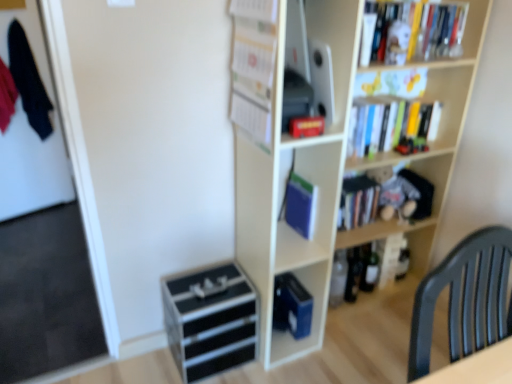
At what (x,y) coordinates should I click in order to perform the action: click on hardcover books at upper right. Please return your answer as a coordinate pair (x, y). The height and width of the screenshot is (384, 512). Looking at the image, I should click on (448, 101).

Where is `blue matte book at center, arranged as the 2th paperback book when viewed from the top`? blue matte book at center, arranged as the 2th paperback book when viewed from the top is located at coordinates (292, 306).

The image size is (512, 384). Describe the element at coordinates (370, 269) in the screenshot. I see `green glass bottle at lower right, which appears as the 2th beer bottle when viewed from the left` at that location.

What is the approximate width of matte black speaker at upper center?

The width of matte black speaker at upper center is 24.66 centimeters.

The height and width of the screenshot is (384, 512). What are the coordinates of `blue matte book at center, which is the first paperback book in top-to-bottom order` in the screenshot? It's located at point(301,205).

The height and width of the screenshot is (384, 512). Describe the element at coordinates (301, 205) in the screenshot. I see `blue matte book at center, which is the first paperback book in top-to-bottom order` at that location.

Describe the element at coordinates (422, 32) in the screenshot. Image resolution: width=512 pixels, height=384 pixels. I see `hardcover book at upper right, which is the 3th book in left-to-right order` at that location.

The width and height of the screenshot is (512, 384). Identify the location of dark blue fabric at left. (29, 81).

From a real-world perspective, is black glass beer bottle at lower center, positioned as the first beer bottle in left-to-right order, under dark blue fabric at left?

Yes, from a real-world perspective, black glass beer bottle at lower center, positioned as the first beer bottle in left-to-right order, is under dark blue fabric at left.

Does point (350, 277) come farther from viewer compared to point (14, 71)?

No, (350, 277) is in front of (14, 71).

Is black glass beer bottle at lower center, positioned as the first beer bottle in left-to-right order, in front of or behind dark blue fabric at left in the image?

black glass beer bottle at lower center, positioned as the first beer bottle in left-to-right order, is in front of dark blue fabric at left.

Where is `clothe above the black glass beer bottle at lower center, marked as the 2th beer bottle in a right-to-left arrangement (from a real-world perspective)`? clothe above the black glass beer bottle at lower center, marked as the 2th beer bottle in a right-to-left arrangement (from a real-world perspective) is located at coordinates (29, 81).

From their relative heights in the image, would you say plush gray bear at upper right is taller or shorter than blue matte book at center, which is the first paperback book in top-to-bottom order?

Clearly, plush gray bear at upper right is taller compared to blue matte book at center, which is the first paperback book in top-to-bottom order.

Is blue matte book at center, the first paperback book viewed from the front, at the back of plush gray bear at upper right?

No, plush gray bear at upper right is not facing the opposite direction of blue matte book at center, the first paperback book viewed from the front.

Consider the image. Is plush gray bear at upper right touching blue matte book at center, the first paperback book viewed from the front?

No, plush gray bear at upper right is not with blue matte book at center, the first paperback book viewed from the front.

Is plush gray bear at upper right further to camera compared to blue matte book at center, which is the first paperback book in top-to-bottom order?

That is True.

Is blue matte book at center, arranged as the 2th paperback book when viewed from the top, looking in the opposite direction of black plastic drawer at lower center?

No, blue matte book at center, arranged as the 2th paperback book when viewed from the top, is not facing away from black plastic drawer at lower center.

From the image's perspective, is blue matte book at center, acting as the second paperback book starting from the front, above or below black plastic drawer at lower center?

blue matte book at center, acting as the second paperback book starting from the front, is above black plastic drawer at lower center.

Is blue matte book at center, arranged as the 2th paperback book when viewed from the top, smaller than black plastic drawer at lower center?

Indeed, blue matte book at center, arranged as the 2th paperback book when viewed from the top, has a smaller size compared to black plastic drawer at lower center.

Which is in front, blue matte book at center, the 1th paperback book viewed from the back, or black plastic drawer at lower center?

Positioned in front is black plastic drawer at lower center.

Is white paper calendar at upper center, the 1th book positioned from the left, to the left of blue matte book at center, which ranks as the second paperback book in back-to-front order, from the viewer's perspective?

Correct, you'll find white paper calendar at upper center, the 1th book positioned from the left, to the left of blue matte book at center, which ranks as the second paperback book in back-to-front order.

From the image's perspective, count 1st paperback books downward from the white paper calendar at upper center, the 2th book positioned from the top, and point to it. Please provide its 2D coordinates.

[(301, 205)]

Is white paper calendar at upper center, which appears as the 3th book when viewed from the back, with blue matte book at center, the first paperback book viewed from the front?

No, white paper calendar at upper center, which appears as the 3th book when viewed from the back, is not making contact with blue matte book at center, the first paperback book viewed from the front.

Locate an element on the screen. The image size is (512, 384). shelf on the right of the dark blue fabric at left is located at coordinates (448, 101).

Is dark blue fabric at left further to the viewer compared to hardcover books at upper right?

Yes, the depth of dark blue fabric at left is greater than that of hardcover books at upper right.

Considering the relative sizes of dark blue fabric at left and hardcover books at upper right in the image provided, is dark blue fabric at left wider than hardcover books at upper right?

Incorrect, the width of dark blue fabric at left does not surpass that of hardcover books at upper right.

Find the location of a particular element. The image size is (512, 384). cabinet located in front of the hardcover book at upper right, which is the 3th book in left-to-right order is located at coordinates (312, 55).

From the image's perspective, which one is positioned higher, matte black speaker at upper center or hardcover book at upper right, arranged as the first book when viewed from the right?

hardcover book at upper right, arranged as the first book when viewed from the right.

Is hardcover book at upper right, which is counted as the second book, starting from the front, inside matte black speaker at upper center?

No.

From a real-world perspective, is matte black speaker at upper center under hardcover book at upper right, which is counted as the second book, starting from the front?

Yes, from a real-world perspective, matte black speaker at upper center is beneath hardcover book at upper right, which is counted as the second book, starting from the front.

Is matte black speaker at upper center spatially inside blue matte book at center, the first paperback book ordered from the bottom, or outside of it?

matte black speaker at upper center cannot be found inside blue matte book at center, the first paperback book ordered from the bottom.

Considering the relative sizes of matte black speaker at upper center and blue matte book at center, arranged as the 2th paperback book when viewed from the top, in the image provided, is matte black speaker at upper center smaller than blue matte book at center, arranged as the 2th paperback book when viewed from the top,?

No, matte black speaker at upper center is not smaller than blue matte book at center, arranged as the 2th paperback book when viewed from the top.

From the image's perspective, count 2nd paperback books downward from the matte black speaker at upper center and point to it. Please provide its 2D coordinates.

[(292, 306)]

Consider the image. From the image's perspective, would you say matte black speaker at upper center is positioned over blue matte book at center, the 1th paperback book viewed from the back?

Yes, from the image's perspective, matte black speaker at upper center is above blue matte book at center, the 1th paperback book viewed from the back.

Find the location of `clothe that is above the black glass beer bottle at lower center, marked as the 2th beer bottle in a right-to-left arrangement (from the image's perspective)`. clothe that is above the black glass beer bottle at lower center, marked as the 2th beer bottle in a right-to-left arrangement (from the image's perspective) is located at coordinates (29, 81).

Image resolution: width=512 pixels, height=384 pixels. I want to click on paperback book above the plush gray bear at upper right (from a real-world perspective), so click(x=301, y=205).

Estimate the real-world distances between objects in this image. Which object is closer to green glass bottle at lower right, marked as the first beer bottle in a right-to-left arrangement, blue matte book at center, which is the first paperback book in top-to-bottom order, or hardcover books at upper right?

blue matte book at center, which is the first paperback book in top-to-bottom order.

When comparing their distances from blue matte book at center, the first paperback book ordered from the bottom, does plush gray bear at upper right or black plastic drawer at lower center seem further?

Based on the image, plush gray bear at upper right appears to be further to blue matte book at center, the first paperback book ordered from the bottom.

From the picture: Considering their positions, is hardcover books at upper right positioned closer to white paper calendar at upper center, the 1th book positioned from the left, than wooden bookcase at upper right?

The object closer to white paper calendar at upper center, the 1th book positioned from the left, is wooden bookcase at upper right.

Which object lies nearer to the anchor point blue matte book at center, the second paperback book ordered from the bottom, plush gray bear at upper right or dark blue fabric at left?

Among the two, plush gray bear at upper right is located nearer to blue matte book at center, the second paperback book ordered from the bottom.

Looking at the image, which one is located further to blue matte book at center, acting as the second paperback book starting from the front, matte black speaker at upper center or black plastic drawer at lower center?

matte black speaker at upper center.

Which object lies further to the anchor point hardcover book at upper right, arranged as the first book when viewed from the right, white paper calendar at upper center, which appears as the 3th book when viewed from the back, or blue matte book at center, the first paperback book ordered from the bottom?

Among the two, blue matte book at center, the first paperback book ordered from the bottom, is located further to hardcover book at upper right, arranged as the first book when viewed from the right.

Considering their positions, is matte black speaker at upper center positioned closer to hardcover book at upper right, which is the 2th book in back-to-front order, than green glass bottle at lower right, which appears as the 2th beer bottle when viewed from the left?

The object closer to hardcover book at upper right, which is the 2th book in back-to-front order, is matte black speaker at upper center.

From the image, which object appears to be farther from hardcover books at upper right, dark blue fabric at left or plush gray bear at upper right?

Among the two, dark blue fabric at left is located further to hardcover books at upper right.

This screenshot has width=512, height=384. Find the location of `cabinet located between white paper calendar at upper center, the 1th book positioned from the left, and hardcover book at upper right, placed as the first book when sorted from top to bottom, in the left-right direction`. cabinet located between white paper calendar at upper center, the 1th book positioned from the left, and hardcover book at upper right, placed as the first book when sorted from top to bottom, in the left-right direction is located at coordinates (312, 55).

Identify the location of bookcase positioned between white paper calendar at upper center, the 1th book positioned from the left, and green glass bottle at lower right, marked as the first beer bottle in a right-to-left arrangement, from near to far. The height and width of the screenshot is (384, 512). (336, 171).

At what (x,y) coordinates should I click in order to perform the action: click on bookcase between matte black speaker at upper center and black plastic drawer at lower center in the vertical direction. Please return your answer as a coordinate pair (x, y). The image size is (512, 384). Looking at the image, I should click on (336, 171).

Locate an element on the screen. The width and height of the screenshot is (512, 384). bookcase that lies between hardcover books at upper right and black plastic drawer at lower center from top to bottom is located at coordinates (336, 171).